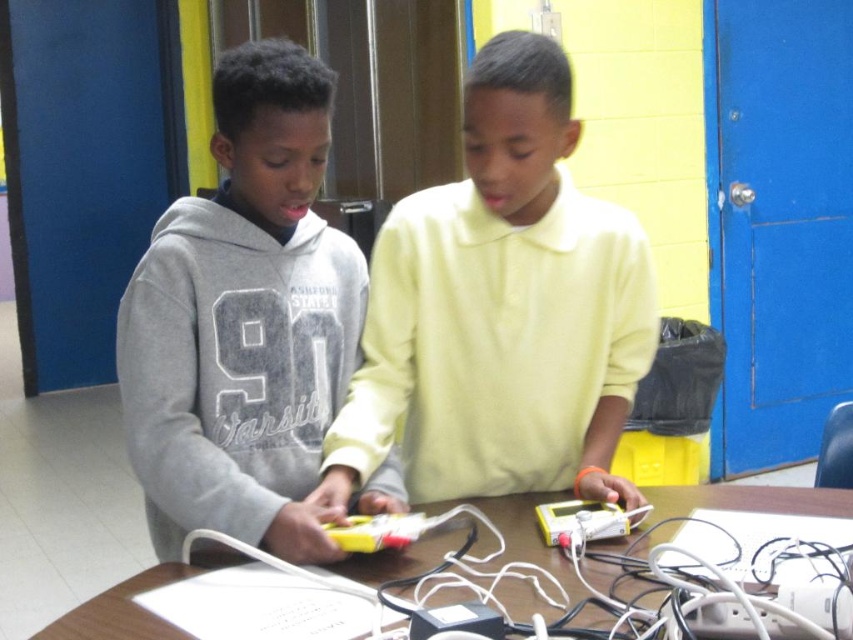
Question: Which object is farther from the camera taking this photo?

Choices:
 (A) gray matte hoodie at left
 (B) light yellow smooth shirt at center
 (C) wooden table at center

Answer: (B)

Question: Is light yellow smooth shirt at center bigger than gray matte hoodie at left?

Choices:
 (A) no
 (B) yes

Answer: (B)

Question: Is light yellow smooth shirt at center to the left of wooden table at center from the viewer's perspective?

Choices:
 (A) no
 (B) yes

Answer: (B)

Question: Considering the real-world distances, which object is closest to the light yellow smooth shirt at center?

Choices:
 (A) gray matte hoodie at left
 (B) wooden table at center

Answer: (A)

Question: Can you confirm if gray matte hoodie at left is positioned above wooden table at center?

Choices:
 (A) yes
 (B) no

Answer: (A)

Question: Which point appears farthest from the camera in this image?

Choices:
 (A) (598, 268)
 (B) (340, 566)

Answer: (A)